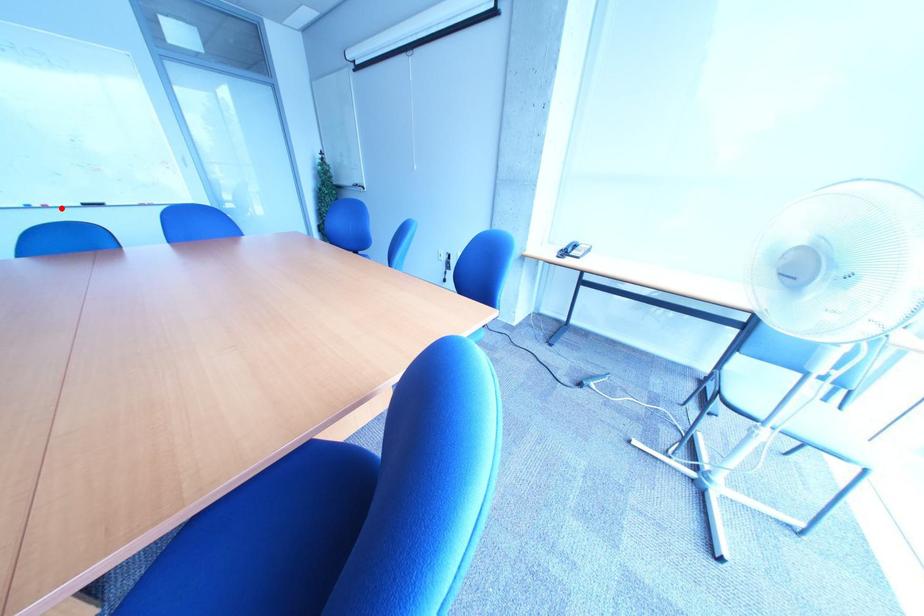
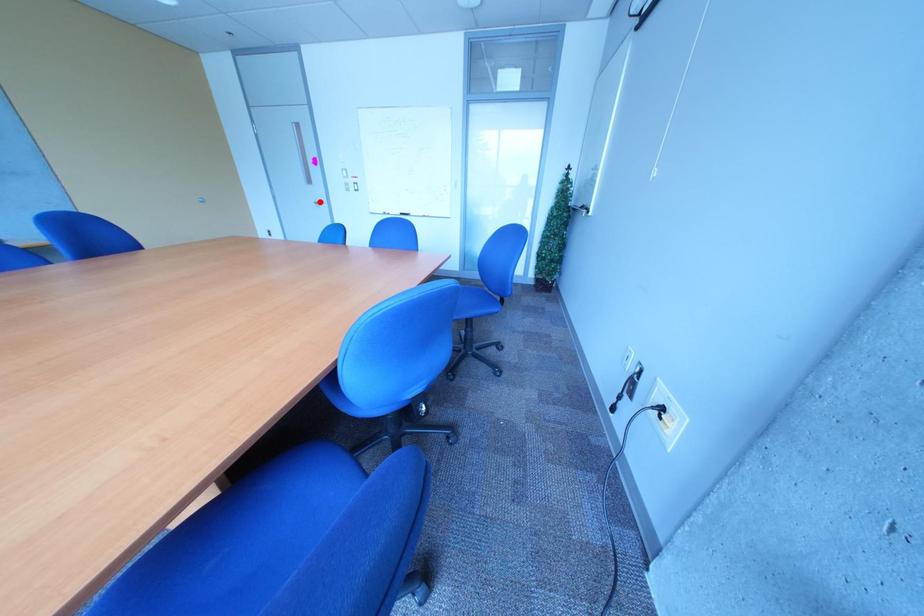
I am providing you with two images of the same scene from different viewpoints. A red point is marked on the first image and another point is marked on the second image. Are the points marked in image1 and image2 representing the same 3D position?

No